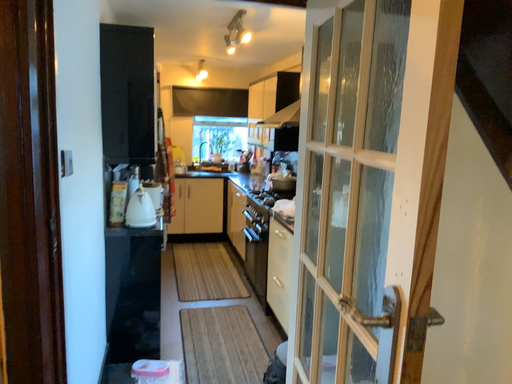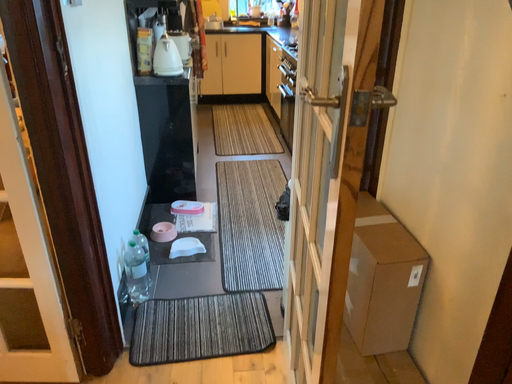
Question: Which way did the camera rotate in the video?

Choices:
 (A) rotated left
 (B) rotated right

Answer: (A)